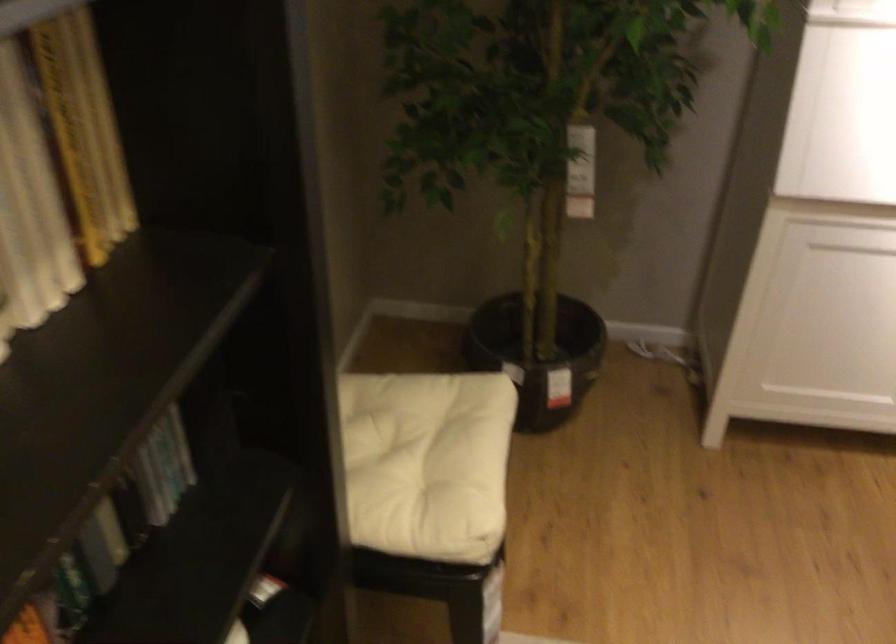
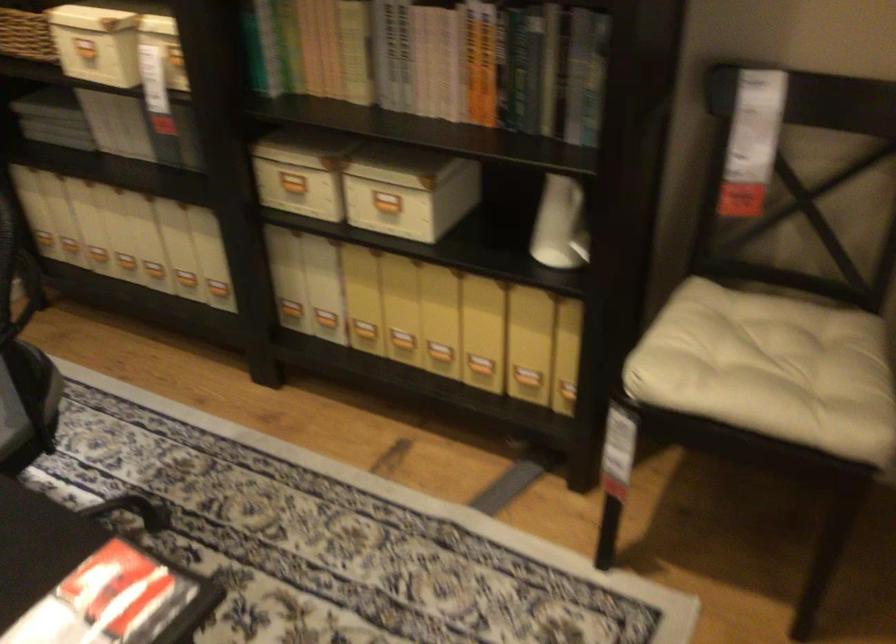
Where in the second image is the point corresponding to [409,465] from the first image?

(776, 366)